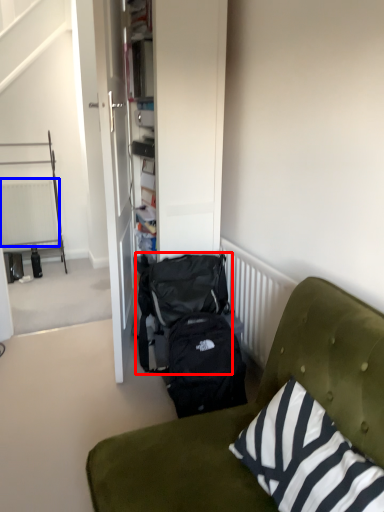
Question: Which object appears closest to the camera in this image, backpack (highlighted by a red box) or radiator (highlighted by a blue box)?

Choices:
 (A) backpack
 (B) radiator

Answer: (A)